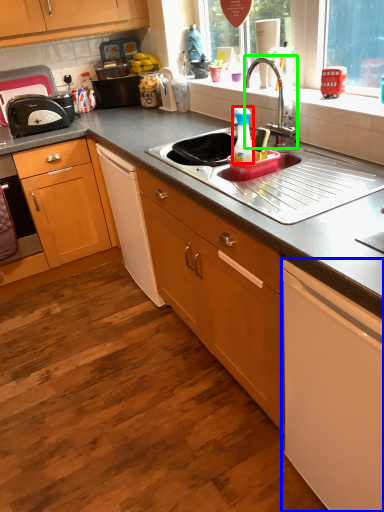
Question: Based on their relative distances, which object is farther from bottle (highlighted by a red box)? Choose from cabinetry (highlighted by a blue box) and tap (highlighted by a green box).

Choices:
 (A) cabinetry
 (B) tap

Answer: (A)